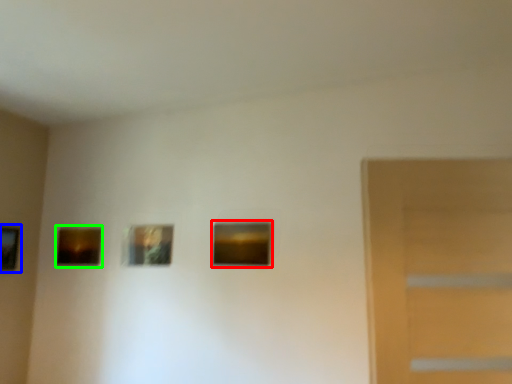
Question: Which object is positioned closest to picture frame (highlighted by a red box)? Select from picture frame (highlighted by a blue box) and picture frame (highlighted by a green box).

Choices:
 (A) picture frame
 (B) picture frame

Answer: (B)